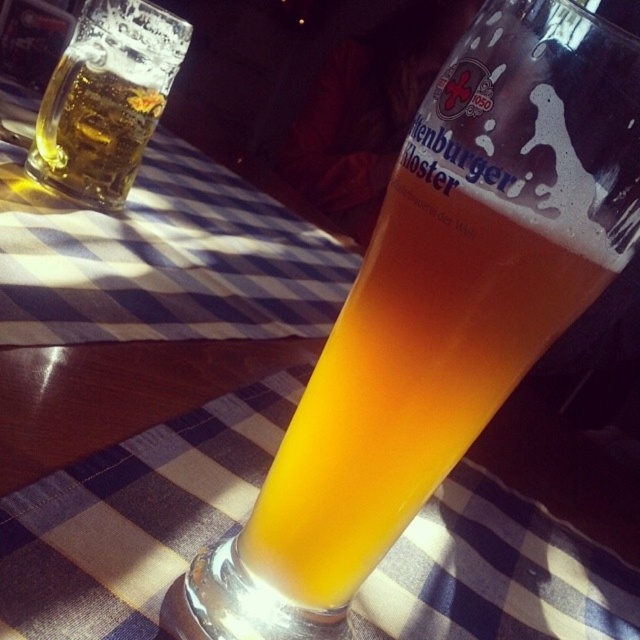
You are standing at the edge of the table where the checkered tablecloth is. You need to place a small coaster exactly where the translucent glass beer at center is located. What are the coordinates where you should place the coaster?

The coordinates for placing the coaster should be at point (438, 312), as that is the 2D location of the translucent glass beer at center.

You are a bartender trying to place a coaster at the exact center between the two glasses of beer. The coordinates of the center point between them are given as point (x=438, y=312). Can you confirm if placing the coaster at this point will be directly under the translucent glass beer at center?

The point (x=438, y=312) marks the translucent glass beer at center, so placing the coaster there will indeed be directly under the translucent glass beer at center.

You are at a German beer festival and want to grab the closest beer to you. You see the translucent glass beer at center and the translucent glass mug at upper left. Which one should you choose?

The translucent glass beer at center is to the right of the translucent glass mug at upper left, so the translucent glass mug at upper left is closer to you and should be chosen.